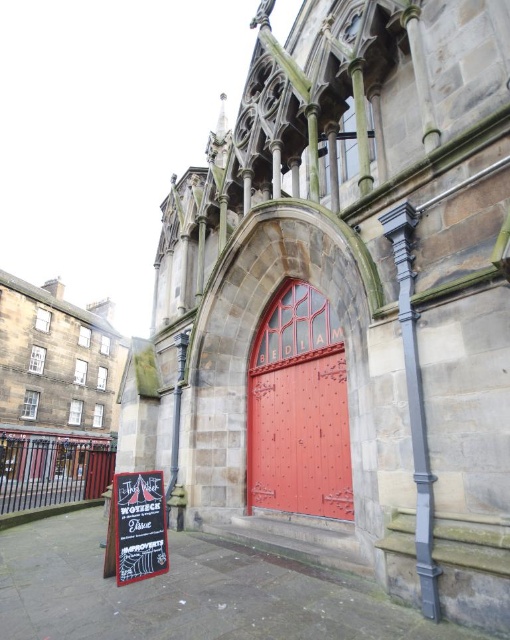
Question: Based on their relative distances, which object is farther from the glossy metal door at center?

Choices:
 (A) smooth stone church at lower left
 (B) black chalkboard sign at lower left

Answer: (A)

Question: Observing the image, what is the correct spatial positioning of smooth stone church at lower left in reference to glossy metal door at center?

Choices:
 (A) above
 (B) below

Answer: (B)

Question: Considering the real-world distances, which object is farthest from the smooth stone church at lower left?

Choices:
 (A) glossy metal door at center
 (B) black chalkboard sign at lower left

Answer: (B)

Question: Does smooth stone church at lower left appear on the right side of glossy metal door at center?

Choices:
 (A) yes
 (B) no

Answer: (B)

Question: Is glossy metal door at center above black chalkboard sign at lower left?

Choices:
 (A) no
 (B) yes

Answer: (B)

Question: Which of the following is the closest to the observer?

Choices:
 (A) (45, 388)
 (B) (348, 484)
 (C) (154, 488)

Answer: (C)